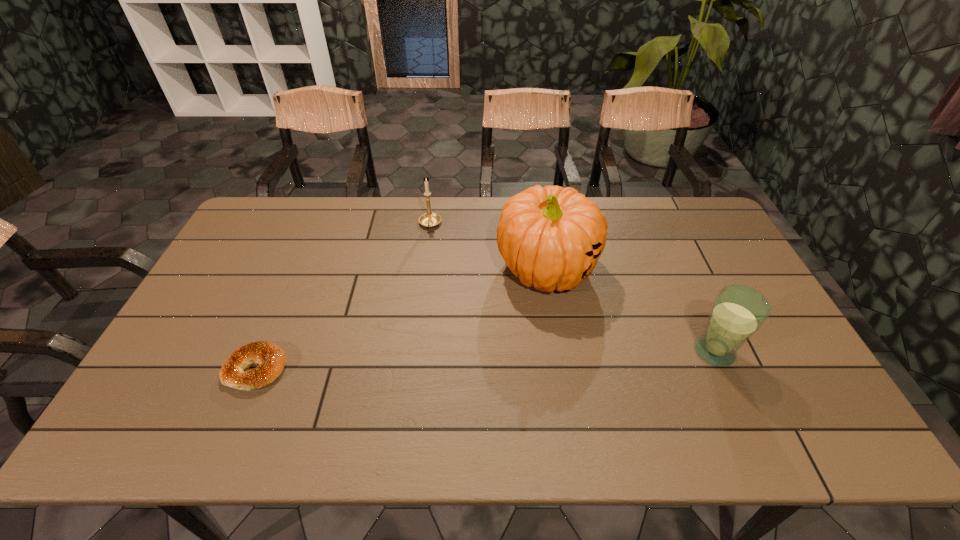
Locate an element on the screen. bagel is located at coordinates (271, 359).

Identify the location of the leftmost object. (271, 359).

You are a GUI agent. You are given a task and a screenshot of the screen. Output one action in this format:
    pyautogui.click(x=<x>, y=<y>)
    Task: Click on the glass
    This screenshot has height=540, width=960.
    Given the screenshot: What is the action you would take?
    738,312

Where is `pumpkin`? This screenshot has height=540, width=960. pumpkin is located at coordinates (551, 238).

You are a GUI agent. You are given a task and a screenshot of the screen. Output one action in this format:
    pyautogui.click(x=<x>, y=<y>)
    Task: Click on the tallest object
    The height and width of the screenshot is (540, 960).
    Given the screenshot: What is the action you would take?
    pyautogui.click(x=551, y=238)

Where is `candle holder`? Image resolution: width=960 pixels, height=540 pixels. candle holder is located at coordinates (429, 219).

Image resolution: width=960 pixels, height=540 pixels. Find the location of `the farthest object`. the farthest object is located at coordinates (429, 219).

What are the coordinates of `blank space located on the back of the shortest object` in the screenshot? It's located at (273, 329).

Locate an element on the screen. This screenshot has width=960, height=540. free region located on the back of the rightmost object is located at coordinates (697, 314).

Where is `vacant region located 0.110m on the surface of the pumpkin`? vacant region located 0.110m on the surface of the pumpkin is located at coordinates (553, 339).